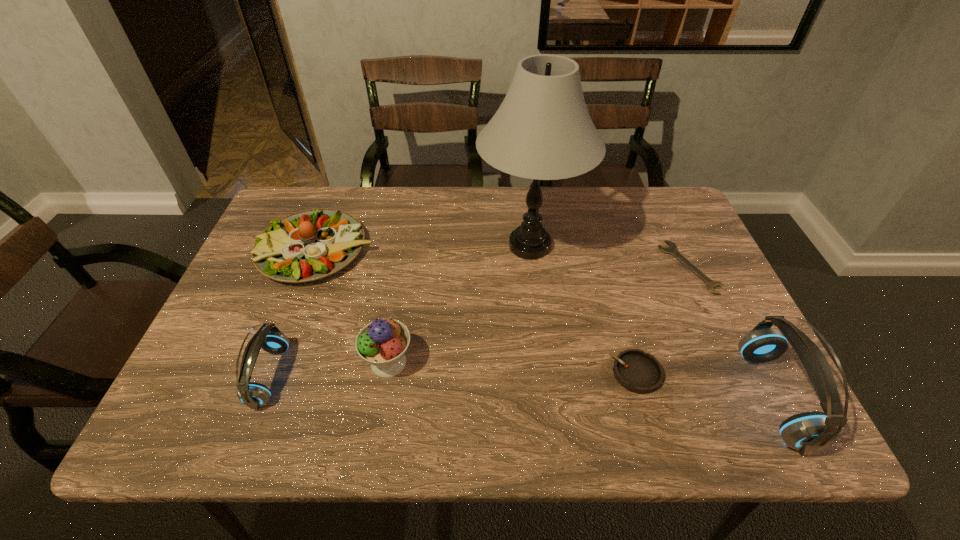
If equal spacing is desired by inserting an extra headset among them, please point out a free spot for this new headset. Please provide its 2D coordinates. Your answer should be formatted as a tuple, i.e. [(x, y)], where the tuple contains the x and y coordinates of a point satisfying the conditions above.

[(516, 387)]